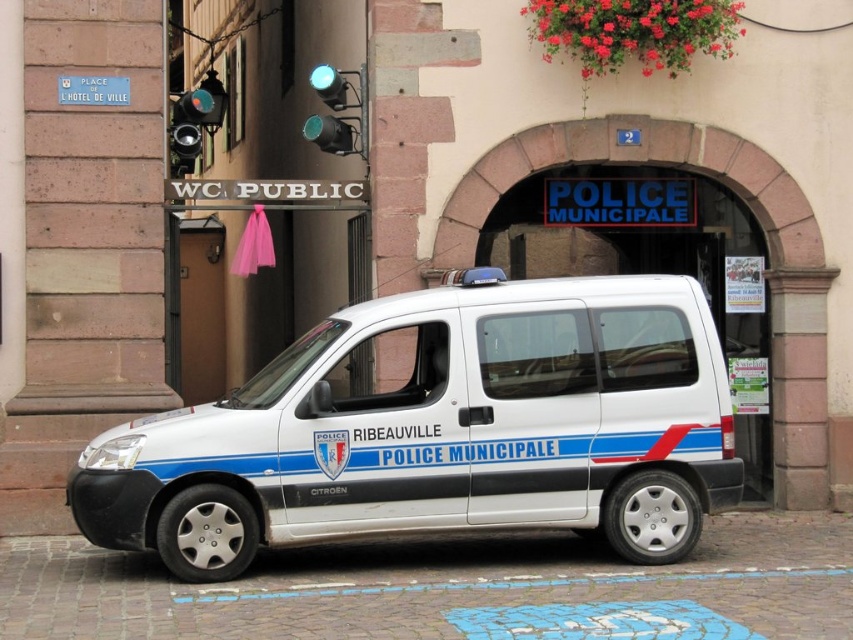
You are a pedestrian standing on the sidewalk looking at the white metallic van at center and the metallic green traffic light at upper center. Which object is located higher in the image?

The metallic green traffic light at upper center is higher because it is positioned above the white metallic van at center.

What is the 2D coordinate of the white metallic van at center in the image?

The white metallic van at center is located at the 2D coordinate point of (440, 428).